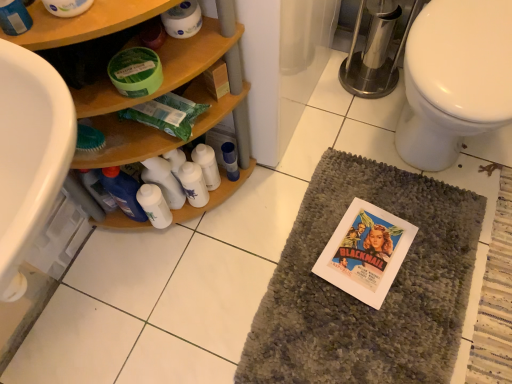
At what (x,y) coordinates should I click in order to perform the action: click on vacant area on top of gray textured bath mat at center (from a real-world perspective). Please return your answer as a coordinate pair (x, y). Looking at the image, I should click on (373, 283).